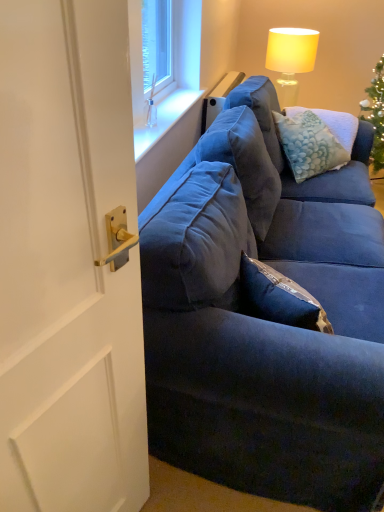
What is the approximate height of matte yellow fabric lampshade at upper right?

matte yellow fabric lampshade at upper right is 53.30 centimeters tall.

What is the approximate width of velvety blue pillow at upper right?

It is 17.62 inches.

This screenshot has height=512, width=384. What do you see at coordinates (266, 324) in the screenshot?
I see `velvet blue couch at right` at bounding box center [266, 324].

Find the location of a particular element. The image size is (384, 512). matte yellow fabric lampshade at upper right is located at coordinates (290, 59).

Between clear glass vase at upper center and matte yellow fabric lampshade at upper right, which one has smaller size?

Smaller between the two is clear glass vase at upper center.

Who is more distant, clear glass vase at upper center or matte yellow fabric lampshade at upper right?

matte yellow fabric lampshade at upper right is further from the camera.

Consider the image. Are clear glass vase at upper center and matte yellow fabric lampshade at upper right beside each other?

clear glass vase at upper center is not next to matte yellow fabric lampshade at upper right, and they're not touching.

Which is closer to the camera, (170, 112) or (272, 56)?

The point (170, 112) is more forward.

Which object is closer to the camera, white glossy door handle at left or velvety blue pillow at upper right?

white glossy door handle at left.

From the image's perspective, which is below, white glossy door handle at left or velvety blue pillow at upper right?

white glossy door handle at left is shown below in the image.

How different are the orientations of white glossy door handle at left and velvety blue pillow at upper right in degrees?

16.1 degrees separate the facing orientations of white glossy door handle at left and velvety blue pillow at upper right.

Is white glossy door handle at left thinner than velvety blue pillow at upper right?

Correct, the width of white glossy door handle at left is less than that of velvety blue pillow at upper right.

Is clear glass vase at upper center looking in the opposite direction of velvety blue pillow at upper right?

No, velvety blue pillow at upper right is not at the back of clear glass vase at upper center.

In the image, is clear glass vase at upper center positioned in front of or behind velvety blue pillow at upper right?

Clearly, clear glass vase at upper center is in front of velvety blue pillow at upper right.

How many degrees apart are the facing directions of clear glass vase at upper center and velvety blue pillow at upper right?

1.64 degrees.

Does clear glass vase at upper center have a lesser width compared to velvety blue pillow at upper right?

Correct, the width of clear glass vase at upper center is less than that of velvety blue pillow at upper right.

Could you tell me if clear glass vase at upper center is turned towards white glossy door handle at left?

No, clear glass vase at upper center does not turn towards white glossy door handle at left.

Is clear glass vase at upper center not inside white glossy door handle at left?

Yes, clear glass vase at upper center is not within white glossy door handle at left.

Can you confirm if clear glass vase at upper center is positioned to the left of white glossy door handle at left?

In fact, clear glass vase at upper center is to the right of white glossy door handle at left.

Considering the relative sizes of velvety blue pillow at upper right and white glossy door handle at left in the image provided, is velvety blue pillow at upper right smaller than white glossy door handle at left?

Incorrect, velvety blue pillow at upper right is not smaller in size than white glossy door handle at left.

Is point (300, 119) less distant than point (21, 155)?

That is False.

Measure the distance from velvety blue pillow at upper right to white glossy door handle at left.

velvety blue pillow at upper right is 5.93 feet away from white glossy door handle at left.

In the scene shown: Considering their positions, is velvety blue pillow at upper right located in front of or behind white glossy door handle at left?

In the image, velvety blue pillow at upper right appears behind white glossy door handle at left.

Between matte yellow fabric lampshade at upper right and clear glass vase at upper center, which one has more height?

Standing taller between the two is matte yellow fabric lampshade at upper right.

From the image's perspective, is matte yellow fabric lampshade at upper right positioned above or below clear glass vase at upper center?

Based on their image positions, matte yellow fabric lampshade at upper right is located above clear glass vase at upper center.

Is matte yellow fabric lampshade at upper right placed right next to clear glass vase at upper center?

No, matte yellow fabric lampshade at upper right is not next to clear glass vase at upper center.

Consider the image. Is matte yellow fabric lampshade at upper right looking in the opposite direction of clear glass vase at upper center?

That's not correct — matte yellow fabric lampshade at upper right is not looking away from clear glass vase at upper center.

Looking at this image, from the image's perspective, is velvet blue couch at right beneath matte yellow fabric lampshade at upper right?

Yes.

Between velvet blue couch at right and matte yellow fabric lampshade at upper right, which one has smaller width?

matte yellow fabric lampshade at upper right.

Is velvet blue couch at right to the left of matte yellow fabric lampshade at upper right from the viewer's perspective?

Indeed, velvet blue couch at right is positioned on the left side of matte yellow fabric lampshade at upper right.

Where is `lamp on the right side of clear glass vase at upper center`? This screenshot has width=384, height=512. lamp on the right side of clear glass vase at upper center is located at coordinates (290, 59).

Identify the location of pillow behind the white glossy door handle at left. (308, 144).

Looking at the image, which one is located closer to clear glass vase at upper center, matte yellow fabric lampshade at upper right or velvety blue pillow at upper right?

velvety blue pillow at upper right is positioned closer to the anchor clear glass vase at upper center.

Based on the photo, when comparing their distances from clear glass vase at upper center, does velvety blue pillow at upper right or white glossy door handle at left seem further?

white glossy door handle at left is positioned further to the anchor clear glass vase at upper center.

From the image, which object appears to be farther from matte yellow fabric lampshade at upper right, velvety blue pillow at upper right or white glossy door handle at left?

The object further to matte yellow fabric lampshade at upper right is white glossy door handle at left.

From the picture: Looking at the image, which one is located closer to velvety blue pillow at upper right, clear glass vase at upper center or matte yellow fabric lampshade at upper right?

The object closer to velvety blue pillow at upper right is matte yellow fabric lampshade at upper right.

Estimate the real-world distances between objects in this image. Which object is closer to matte yellow fabric lampshade at upper right, clear glass vase at upper center or white glossy door handle at left?

clear glass vase at upper center is positioned closer to the anchor matte yellow fabric lampshade at upper right.

When comparing their distances from velvet blue couch at right, does clear glass vase at upper center or white glossy door handle at left seem closer?

The object closer to velvet blue couch at right is white glossy door handle at left.

Considering their positions, is white glossy door handle at left positioned closer to velvety blue pillow at upper right than matte yellow fabric lampshade at upper right?

matte yellow fabric lampshade at upper right is positioned closer to the anchor velvety blue pillow at upper right.

Based on the photo, which object lies further to the anchor point matte yellow fabric lampshade at upper right, white glossy door handle at left or clear glass vase at upper center?

white glossy door handle at left is positioned further to the anchor matte yellow fabric lampshade at upper right.

The image size is (384, 512). In order to click on studio couch between white glossy door handle at left and matte yellow fabric lampshade at upper right in the front-back direction in this screenshot , I will do `click(266, 324)`.

Identify the location of studio couch positioned between white glossy door handle at left and clear glass vase at upper center from near to far. The image size is (384, 512). (x=266, y=324).

The width and height of the screenshot is (384, 512). I want to click on window sill between velvet blue couch at right and matte yellow fabric lampshade at upper right in the front-back direction, so click(165, 120).

The width and height of the screenshot is (384, 512). I want to click on window sill between white glossy door handle at left and matte yellow fabric lampshade at upper right in the front-back direction, so click(165, 120).